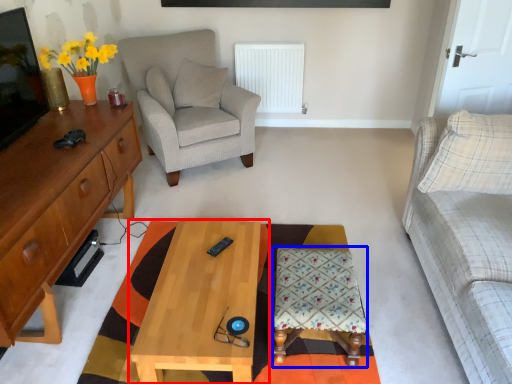
Question: Which of the following is the farthest to the observer, coffee table (highlighted by a red box) or stool (highlighted by a blue box)?

Choices:
 (A) coffee table
 (B) stool

Answer: (B)